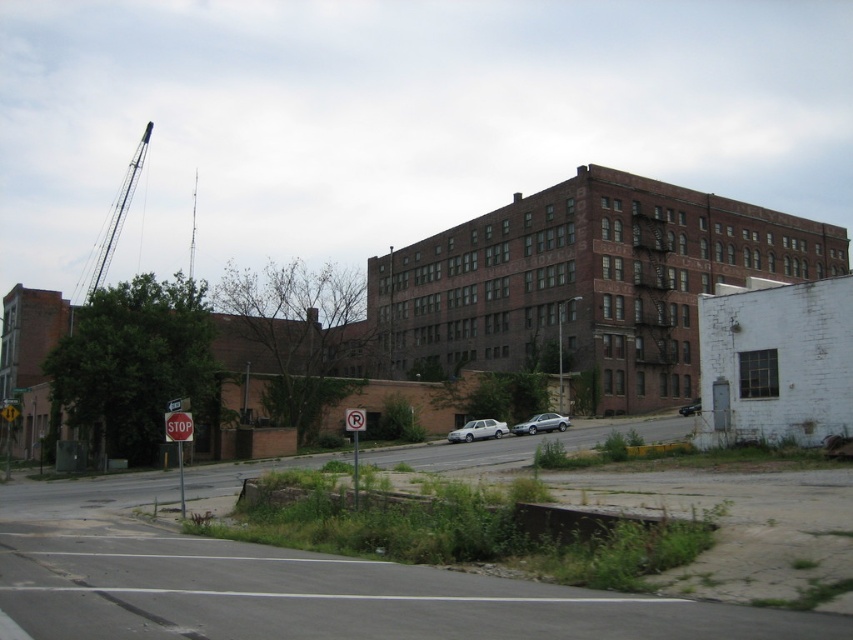
Question: Estimate the real-world distances between objects in this image. Which object is closer to the metallic gray crane at upper left?

Choices:
 (A) silver metallic sedan at center-right
 (B) red painted metal stop sign at center
 (C) white matte sedan at center
 (D) shiny silver sedan at center

Answer: (C)

Question: Does white matte sedan at center have a greater width compared to silver metallic sedan at center-right?

Choices:
 (A) yes
 (B) no

Answer: (A)

Question: Which is farther from the silver metallic sedan at center-right?

Choices:
 (A) red painted metal stop sign at center
 (B) shiny silver sedan at center
 (C) white matte sedan at center

Answer: (A)

Question: Which point is closer to the camera?

Choices:
 (A) (686, 412)
 (B) (497, 424)
 (C) (547, 429)

Answer: (B)

Question: Is silver metallic sedan at center-right further to camera compared to red painted metal stop sign at center?

Choices:
 (A) yes
 (B) no

Answer: (A)

Question: Can you confirm if silver metallic sedan at center-right is positioned to the left of red painted metal stop sign at center?

Choices:
 (A) yes
 (B) no

Answer: (B)